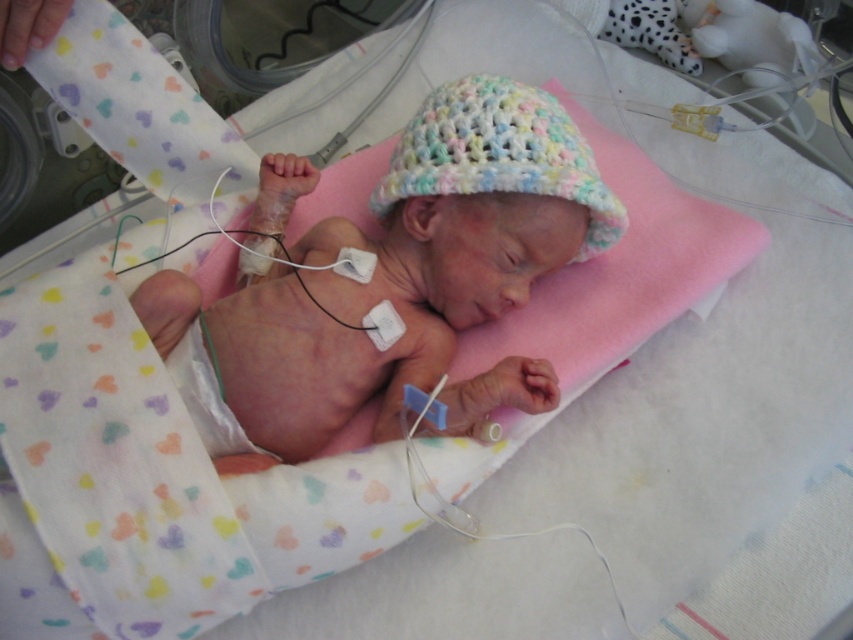
Question: Which point is farther from the camera taking this photo?

Choices:
 (A) (564, 115)
 (B) (498, 259)

Answer: (A)

Question: Considering the relative positions of pastel crocheted hat at center and pastel crochet hat at center in the image provided, where is pastel crocheted hat at center located with respect to pastel crochet hat at center?

Choices:
 (A) left
 (B) right

Answer: (A)

Question: Does pastel crocheted hat at center appear over pastel crochet hat at center?

Choices:
 (A) yes
 (B) no

Answer: (B)

Question: Is pastel crocheted hat at center thinner than pastel crochet hat at center?

Choices:
 (A) no
 (B) yes

Answer: (A)